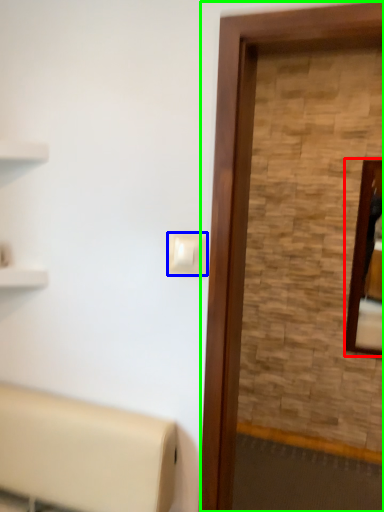
Question: Which object is positioned closest to mirror (highlighted by a red box)? Select from light switch (highlighted by a blue box) and screen door (highlighted by a green box).

Choices:
 (A) light switch
 (B) screen door

Answer: (B)